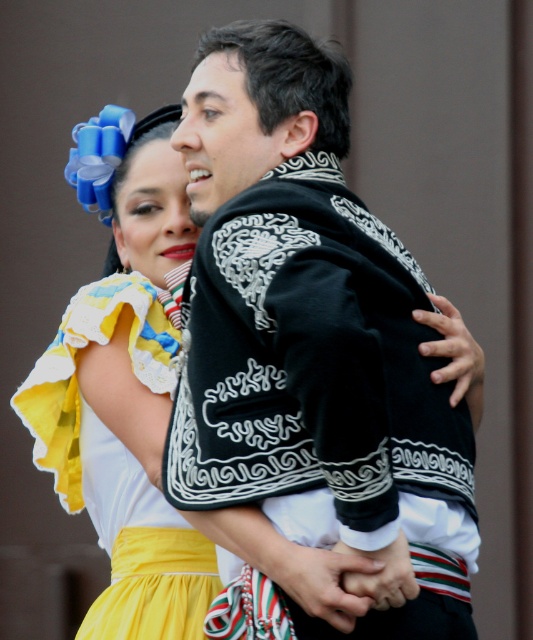
Can you confirm if black embroidered jacket at center is wider than yellow satin dress at lower left?

Correct, the width of black embroidered jacket at center exceeds that of yellow satin dress at lower left.

Who is shorter, black embroidered jacket at center or yellow satin dress at lower left?

With less height is yellow satin dress at lower left.

Is point (273, 504) positioned behind point (164, 561)?

No, (273, 504) is closer to viewer.

Where is `black embroidered jacket at center`? The image size is (533, 640). black embroidered jacket at center is located at coordinates (312, 344).